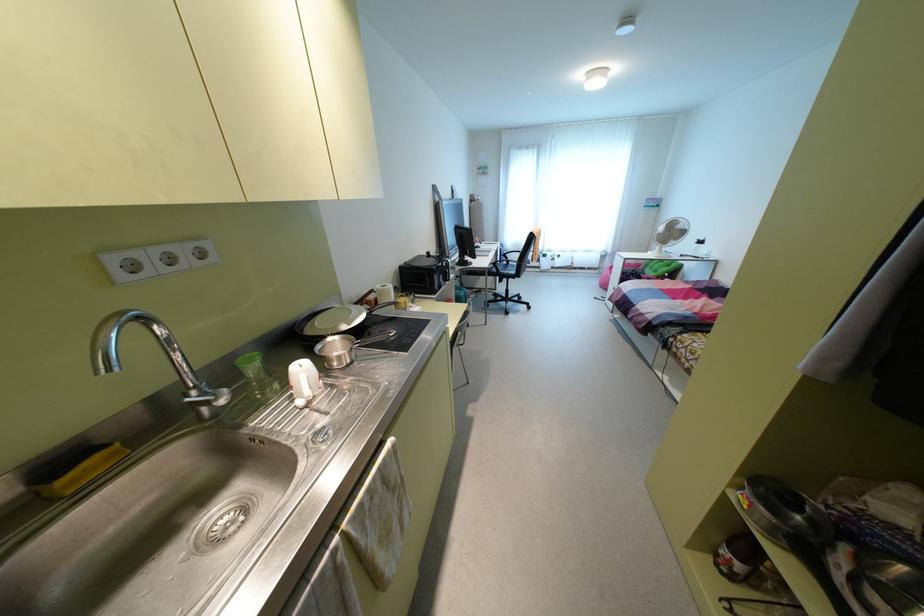
Find where to sit the chair sitting surface. Please return your answer as a coordinate pair (x, y).

(505, 264)